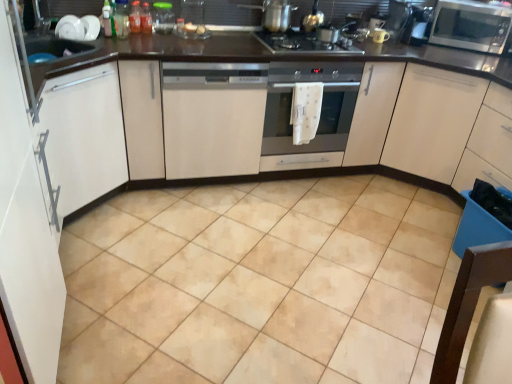
You are a GUI agent. You are given a task and a screenshot of the screen. Output one action in this format:
    pyautogui.click(x=<x>, y=<y>)
    Task: Click on the vacant space to the right of transparent plastic container at upper center, which is counted as the third appliance, starting from the right
    This screenshot has width=512, height=384.
    Given the screenshot: What is the action you would take?
    pyautogui.click(x=192, y=39)